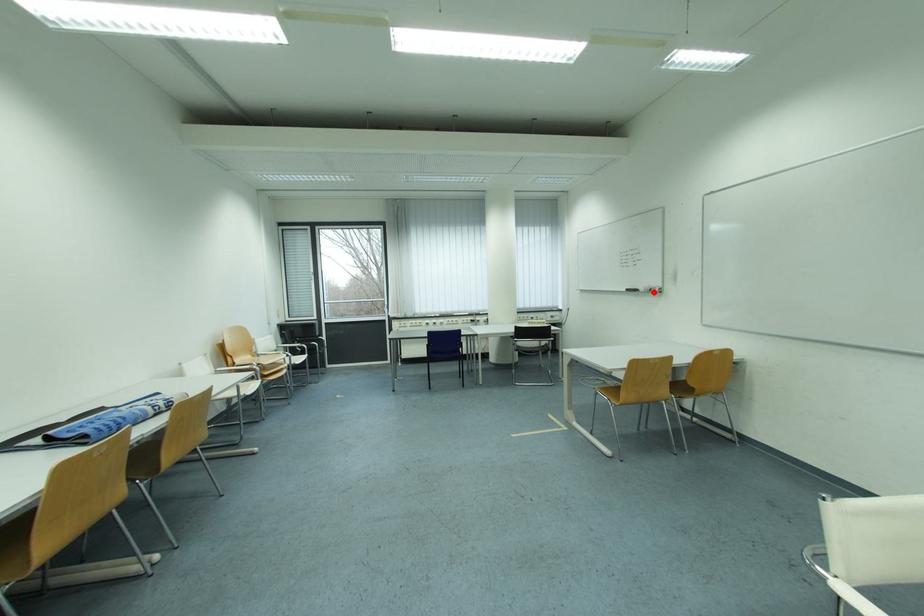
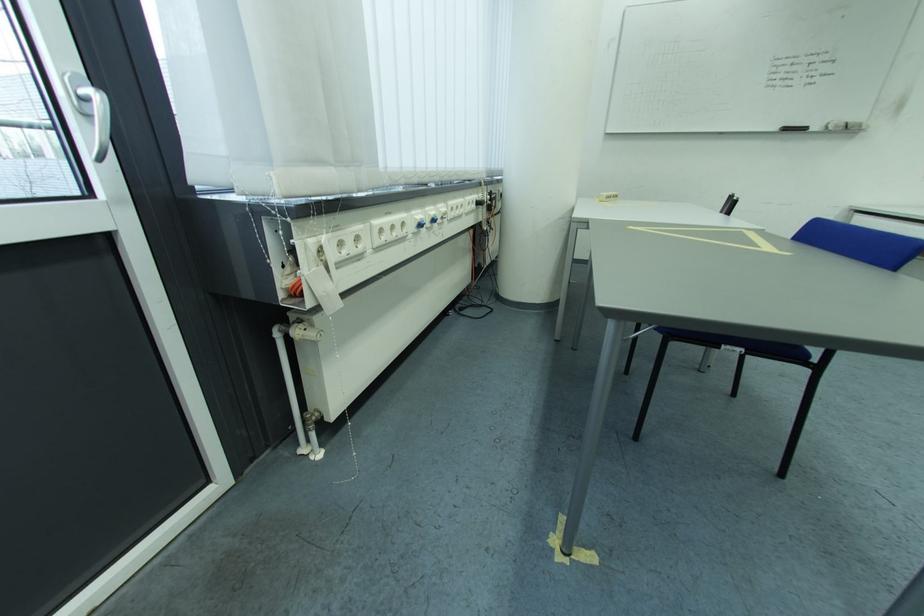
The point at the highlighted location is marked in the first image. Where is the corresponding point in the second image?

(845, 129)